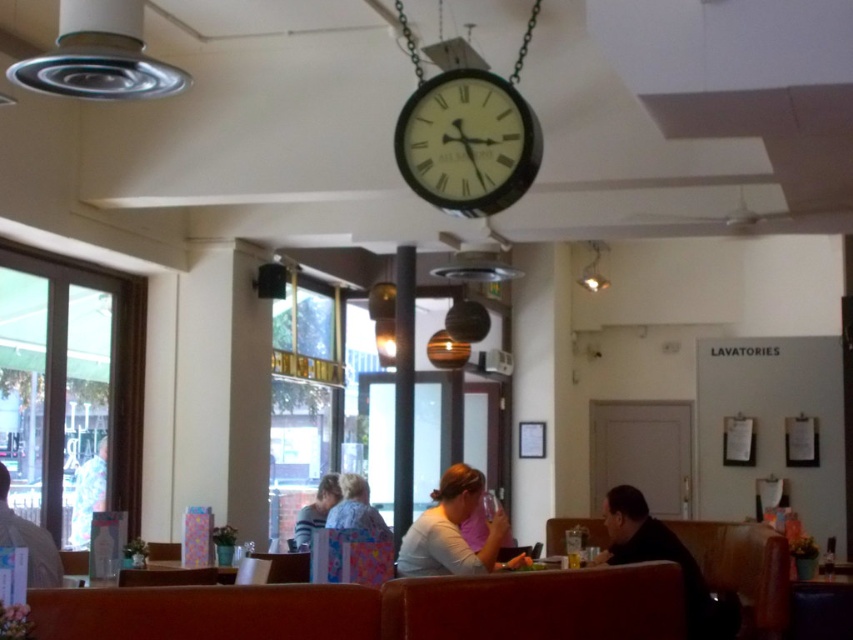
Question: Which object is the closest to the white fabric person at left?

Choices:
 (A) light brown leather jacket at left
 (B) striped sweater at center
 (C) black matte shirt at lower right

Answer: (B)

Question: Is matte white shirt at center above striped sweater at center?

Choices:
 (A) yes
 (B) no

Answer: (A)

Question: Which point is closer to the camera?

Choices:
 (A) (508, 122)
 (B) (47, 584)
 (C) (347, 520)

Answer: (B)

Question: In this image, where is white fabric person at left located relative to striped sweater at center?

Choices:
 (A) below
 (B) above

Answer: (B)

Question: Is black matte shirt at lower right bigger than striped sweater at center?

Choices:
 (A) yes
 (B) no

Answer: (A)

Question: Which of these objects is positioned farthest from the striped sweater at center?

Choices:
 (A) printed fabric shirt at center
 (B) black matte shirt at lower right

Answer: (B)